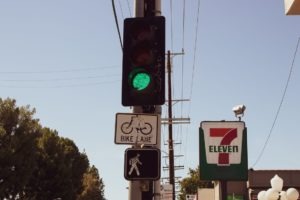
Identify the location of lighting. (278, 183), (297, 193), (270, 195).